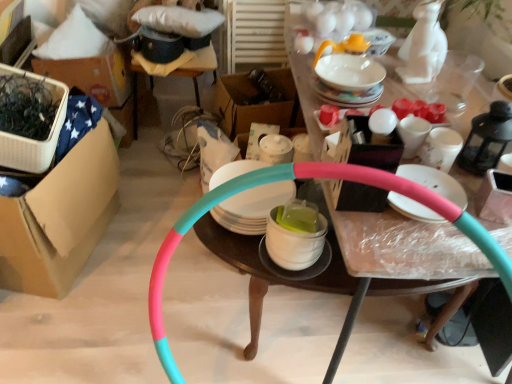
Find the location of a particular element. The height and width of the screenshot is (384, 512). vacant area in front of porcelain teapot at upper right, the first tableware viewed from the top is located at coordinates (347, 92).